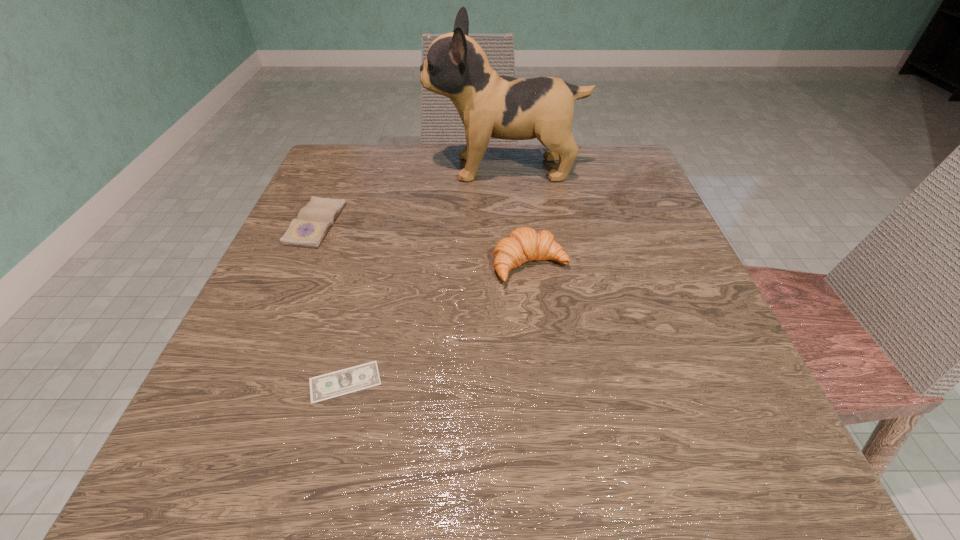
You are a GUI agent. You are given a task and a screenshot of the screen. Output one action in this format:
    pyautogui.click(x=<x>, y=<y>)
    Task: Click on the free spot at the right edge of the desktop
    The image size is (960, 540).
    Given the screenshot: What is the action you would take?
    pyautogui.click(x=694, y=314)

Image resolution: width=960 pixels, height=540 pixels. In the image, there is a desktop. What are the coordinates of `vacant space at the far left corner` in the screenshot? It's located at (373, 180).

I want to click on vacant space at the near left corner of the desktop, so click(x=273, y=433).

Identify the location of blank space at the far right corner of the desktop. The width and height of the screenshot is (960, 540). (651, 198).

Locate an element on the screen. The image size is (960, 540). free point between the diary and the second tallest object is located at coordinates (423, 245).

Find the location of `free space between the shortest object and the leftmost object`. free space between the shortest object and the leftmost object is located at coordinates (330, 303).

Image resolution: width=960 pixels, height=540 pixels. Identify the location of empty space that is in between the shortest object and the third tallest object. (330, 303).

Where is `free area in between the third shortest object and the leftmost object`? free area in between the third shortest object and the leftmost object is located at coordinates (423, 245).

What are the coordinates of `vacant region between the diary and the third shortest object` in the screenshot? It's located at (423, 245).

At what (x,y) coordinates should I click in order to perform the action: click on unoccupied position between the nearest object and the diary. Please return your answer as a coordinate pair (x, y). Looking at the image, I should click on (330, 303).